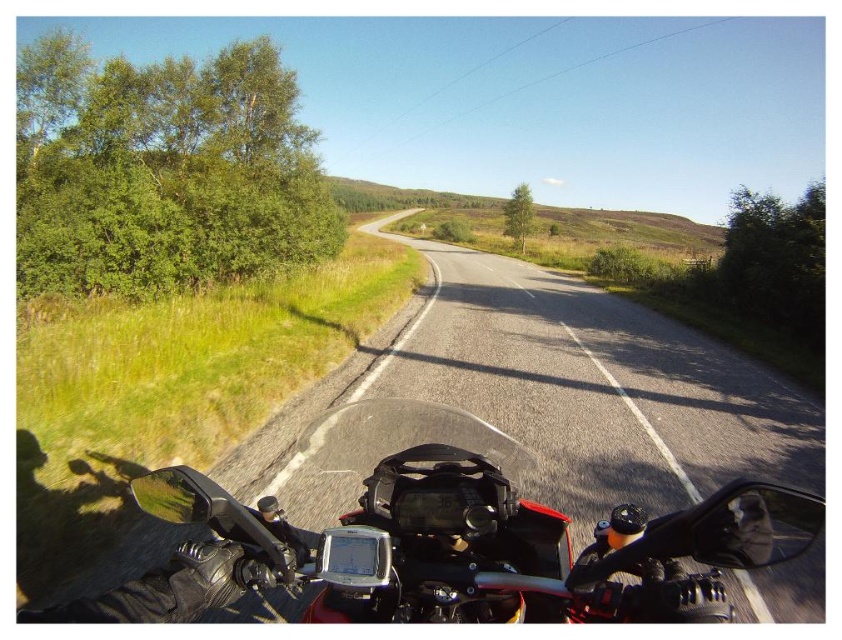
Question: Which point is farther from the camera taking this photo?

Choices:
 (A) (462, 472)
 (B) (292, 529)

Answer: (B)

Question: Is shiny black motorcycle at center to the left of black matte helmet at upper left from the viewer's perspective?

Choices:
 (A) no
 (B) yes

Answer: (A)

Question: Does shiny black motorcycle at center have a larger size compared to black matte helmet at upper left?

Choices:
 (A) no
 (B) yes

Answer: (B)

Question: Which point is farther to the camera?

Choices:
 (A) shiny black motorcycle at center
 (B) black matte helmet at upper left

Answer: (A)

Question: From the image, what is the correct spatial relationship of shiny black motorcycle at center in relation to black matte helmet at upper left?

Choices:
 (A) left
 (B) right

Answer: (B)